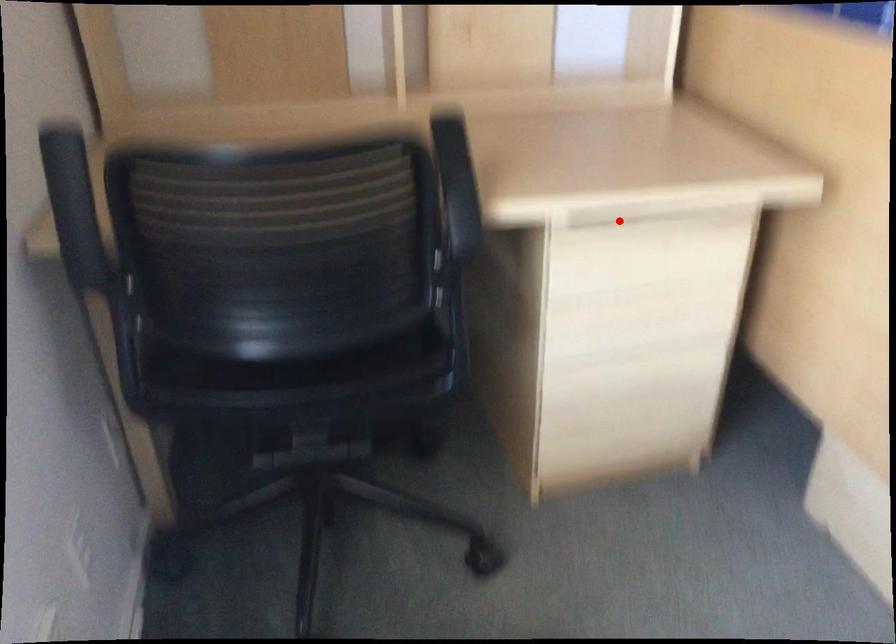
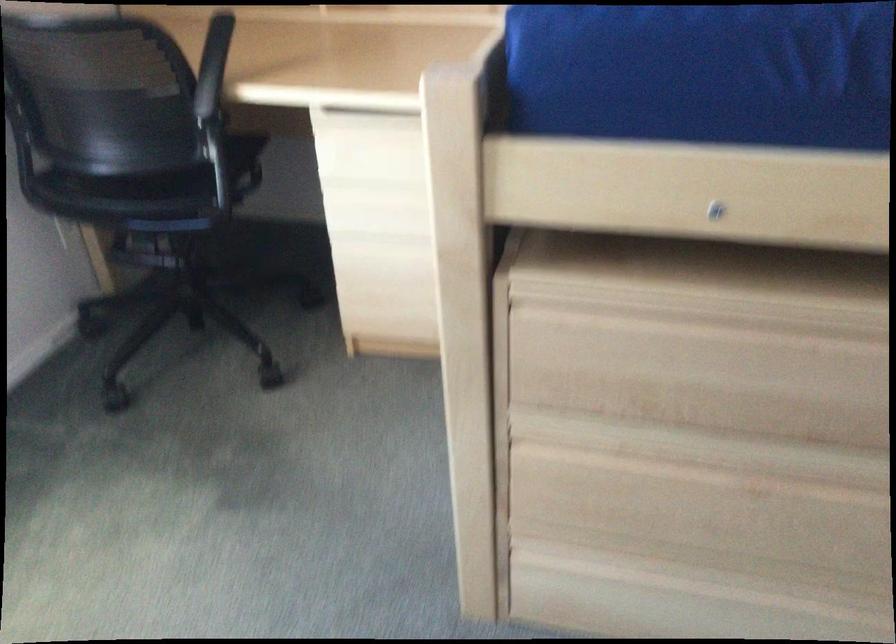
Question: I am providing you with two images of the same scene from different viewpoints. Image1 has a red point marked. In image2, the corresponding 3D location appears at what relative position? Reply with the corresponding letter.

Choices:
 (A) Closer
 (B) Farther

Answer: (B)